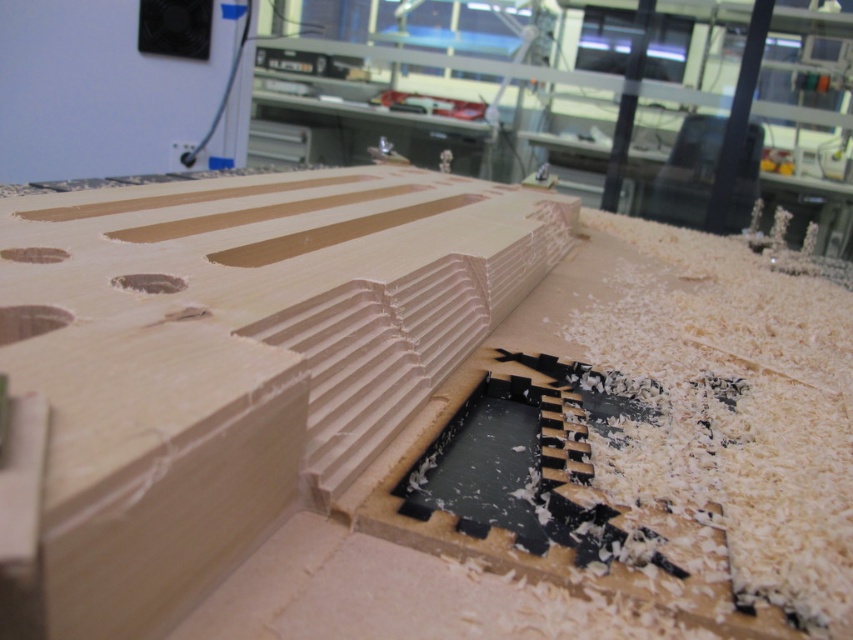
Question: Can you confirm if light brown wood hole at center is bigger than matte wood hole at upper left?

Choices:
 (A) yes
 (B) no

Answer: (A)

Question: Which object is positioned farthest from the natural wood plywood at center?

Choices:
 (A) light brown wood hole at center
 (B) matte wood hole at upper left
 (C) matte brown wood at center

Answer: (A)

Question: Can you confirm if natural wood plywood at center is thinner than matte brown wood at center?

Choices:
 (A) no
 (B) yes

Answer: (A)

Question: Which of these objects is positioned closest to the natural wood plank at center?

Choices:
 (A) light brown wood hole at center
 (B) natural wood plywood at center
 (C) matte brown wood at center

Answer: (B)

Question: Which point is farther to the camera?

Choices:
 (A) (213, 204)
 (B) (463, 198)
 (C) (15, 250)
 (D) (51, 308)

Answer: (B)

Question: Is natural wood plywood at center positioned before natural wood plank at center?

Choices:
 (A) no
 (B) yes

Answer: (B)